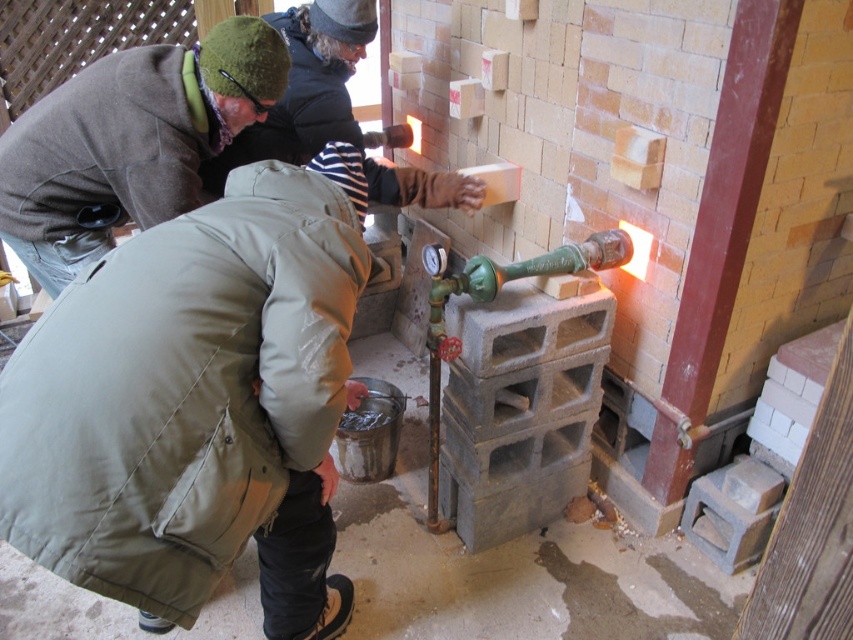
You are standing in a partially constructed building and want to reach a point that is 1.44 meters away from you. Can you safely step onto the point located at coordinates point (206, 221)?

The distance of point (206, 221) from viewer is 1.44 meters, so yes, you can safely step onto the point located at coordinates point (206, 221) since it is within a reachable distance.

You are an observer standing in the middle of the construction site. You see the green matte jacket at lower left and the green woolen hat at upper left. Which object is positioned to the right of the other?

The green matte jacket at lower left is to the right of the green woolen hat at upper left.